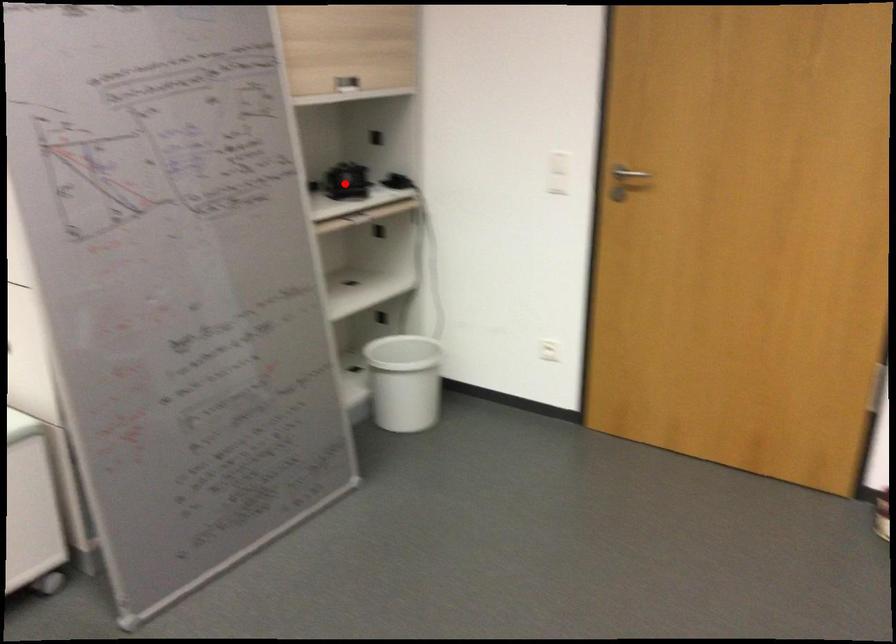
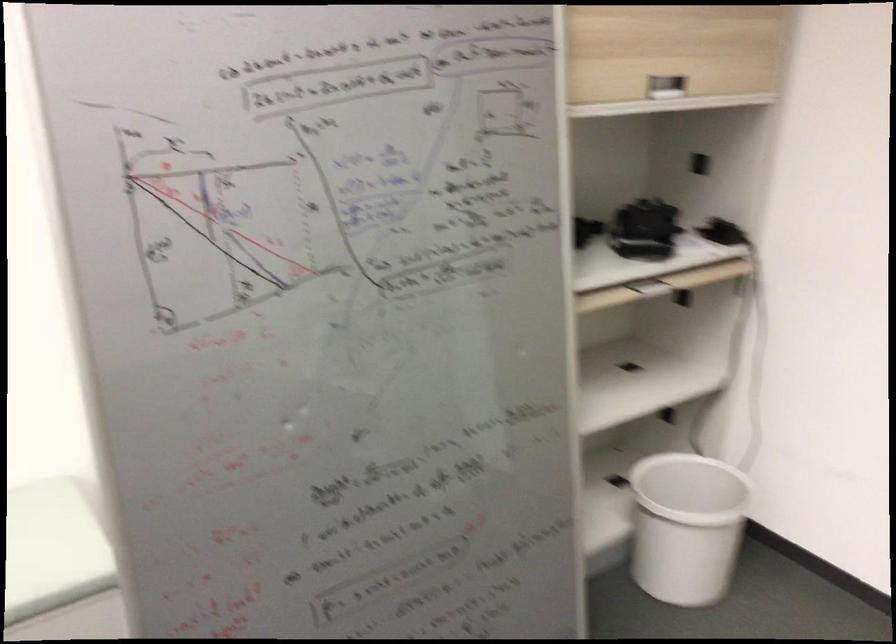
Where in the second image is the point corresponding to the highlighted location from the first image?

(643, 230)